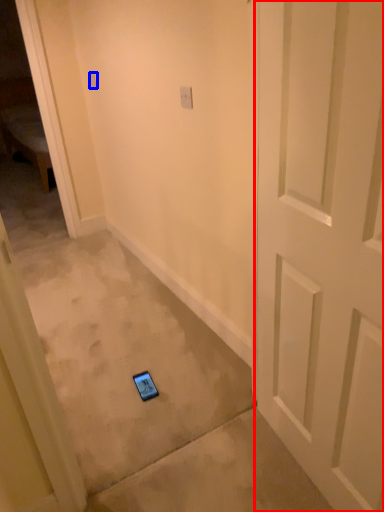
Question: Which point is further to the camera, door (highlighted by a red box) or light switch (highlighted by a blue box)?

Choices:
 (A) door
 (B) light switch

Answer: (B)